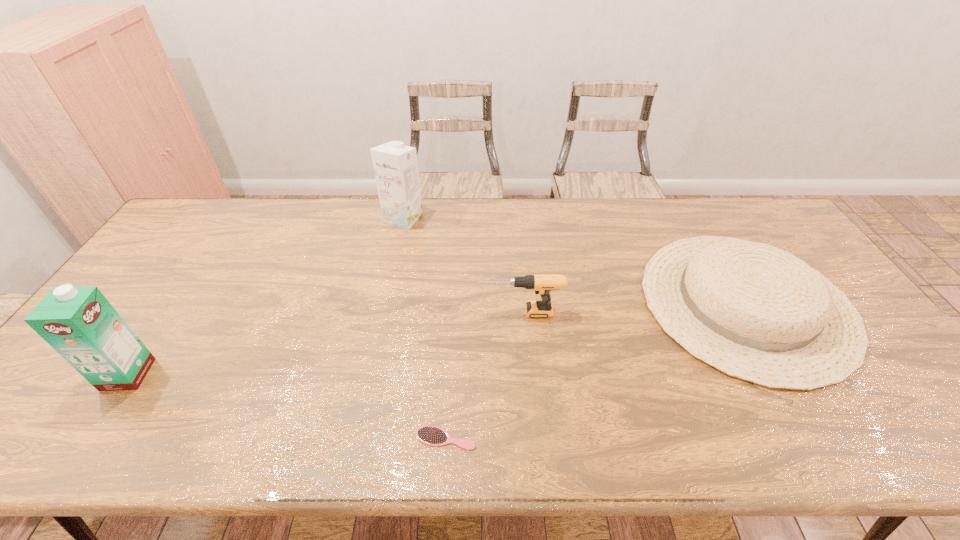
Locate an element on the screen. The image size is (960, 540). object that stands as the third closest to the hairbrush is located at coordinates [79, 323].

The image size is (960, 540). Find the location of `vacant area in the image that satisfies the following two spatial constraints: 1. on the back side of the third object from left to right; 2. on the right side of the sunhat`. vacant area in the image that satisfies the following two spatial constraints: 1. on the back side of the third object from left to right; 2. on the right side of the sunhat is located at coordinates (453, 303).

Identify the location of free location that satisfies the following two spatial constraints: 1. on the handle side of the fourth object from left to right; 2. on the front side of the nearer carton. This screenshot has width=960, height=540. (525, 374).